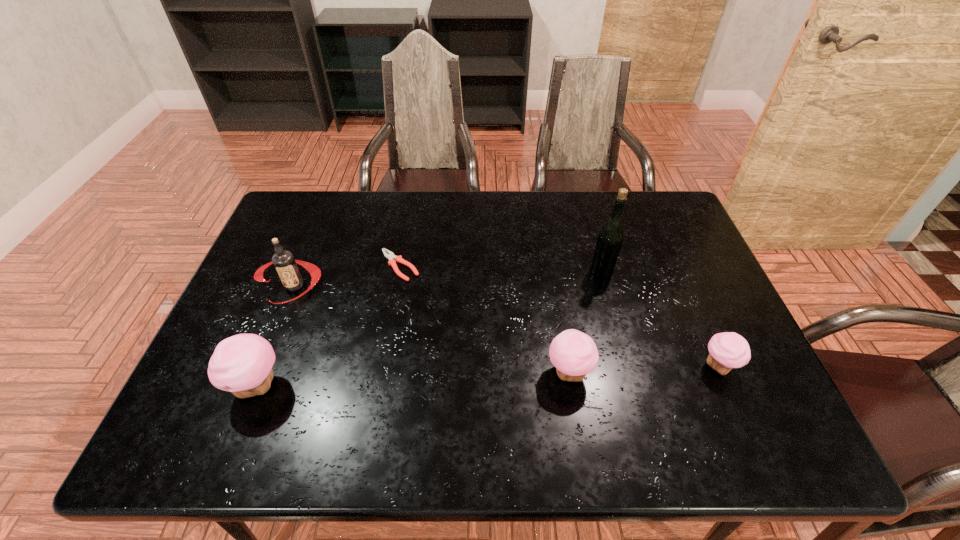
Locate an element on the screen. vacant point located 0.090m on the right of the tallest cupcake is located at coordinates (324, 386).

What are the coordinates of `vacant position located on the left of the second cupcake from left to right` in the screenshot? It's located at (423, 372).

The image size is (960, 540). What are the coordinates of `vacant region located on the back of the rightmost cupcake` in the screenshot? It's located at (684, 288).

The width and height of the screenshot is (960, 540). I want to click on blank space located 0.120m on the left of the pliers, so click(338, 266).

At what (x,y) coordinates should I click in order to perform the action: click on free space located on the label of the root beer. Please return your answer as a coordinate pair (x, y). Looking at the image, I should click on (277, 327).

Image resolution: width=960 pixels, height=540 pixels. What are the coordinates of `vacant area located on the left of the tallest object` in the screenshot? It's located at (541, 272).

You are a GUI agent. You are given a task and a screenshot of the screen. Output one action in this format:
    pyautogui.click(x=<x>, y=<y>)
    Task: Click on the cupcake that is at the left edge
    Image resolution: width=960 pixels, height=540 pixels.
    Given the screenshot: What is the action you would take?
    pyautogui.click(x=242, y=364)

This screenshot has height=540, width=960. I want to click on root beer that is at the left edge, so 285,264.

I want to click on object positioned at the right edge, so coord(728,350).

Locate an element on the screen. object located at the near left corner is located at coordinates pyautogui.click(x=242, y=364).